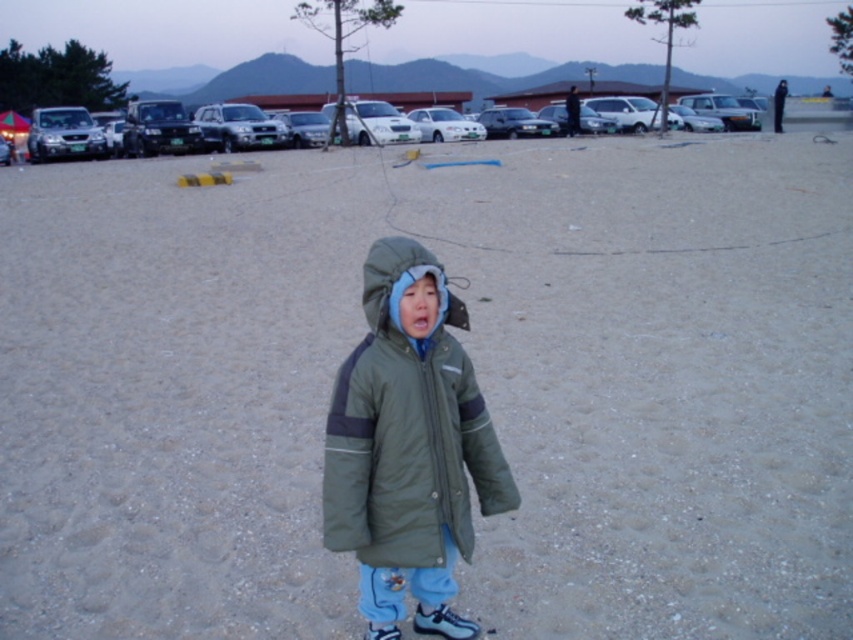
In the scene shown: You are standing in the parking lot and want to walk from point (492, 436) to point (730, 99). Which direction should you face to walk towards the farther point?

You should face towards the background direction because point (730, 99) is farther from the viewer compared to point (492, 436).

You are a photographer trying to capture the child wearing the green matte jacket at center and the silver metallic suv at left in the same frame. Based on their sizes, which object should you focus on first to ensure both are in the frame?

The green matte jacket at center is smaller than the silver metallic suv at left, so you should focus on the green matte jacket at center first to ensure both are in the frame.

Based on the scene described, can you determine which object is wider between the metallic silver suv at upper center and the green fleece hood at center?

The metallic silver suv at upper center is wider than the green fleece hood at center according to the description.